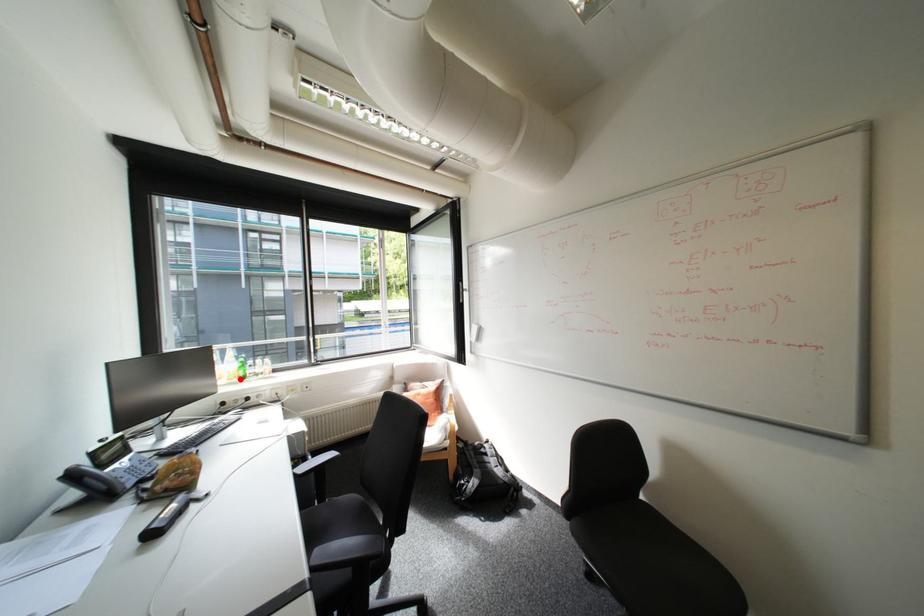
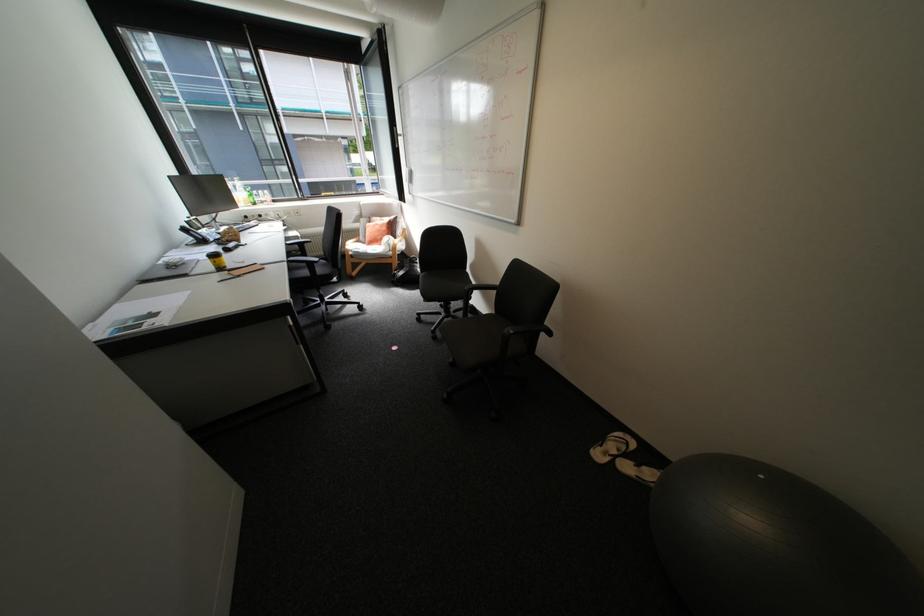
Find the pixel in the second image that matches the highlighted location in the first image.

(256, 204)